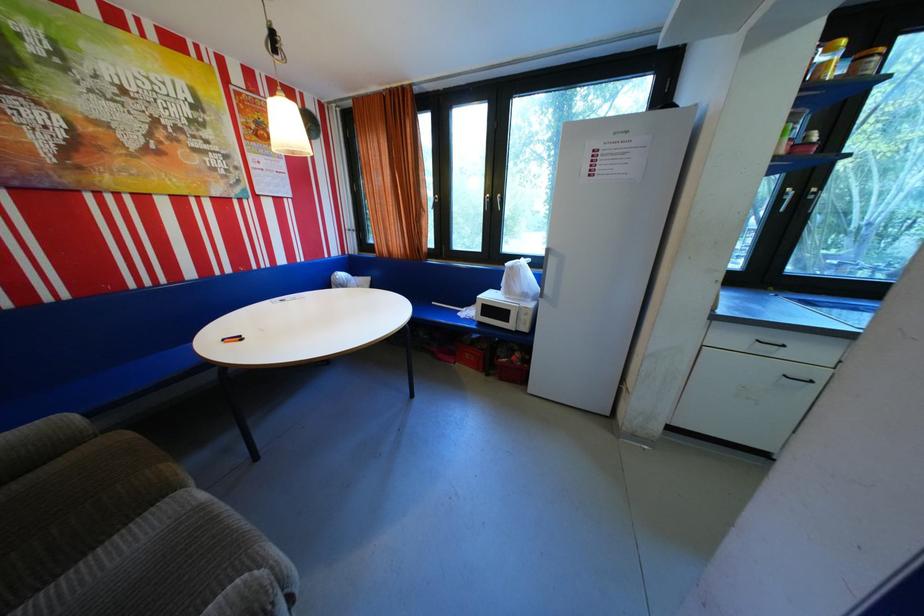
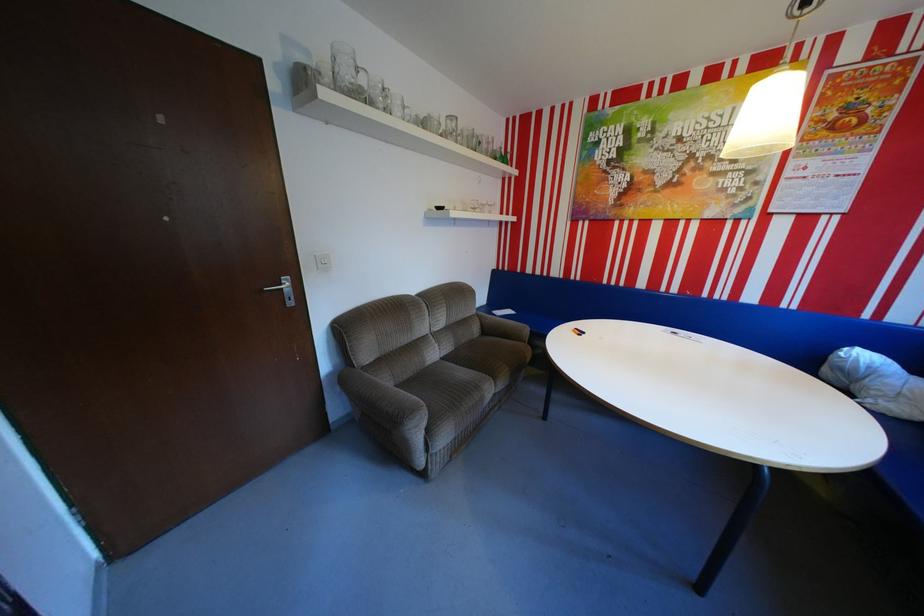
In the second image, find the point that corresponds to (x=353, y=274) in the first image.

(874, 355)